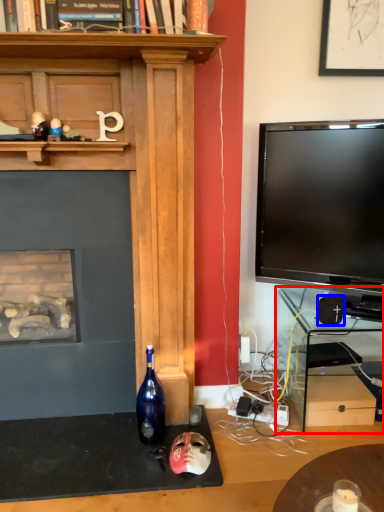
Question: Which point is closer to the camera, computer desk (highlighted by a red box) or speaker (highlighted by a blue box)?

Choices:
 (A) computer desk
 (B) speaker

Answer: (B)